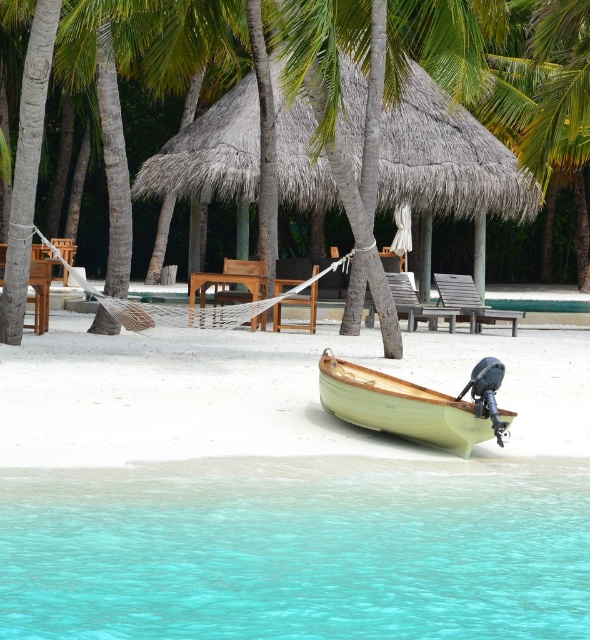
You are standing on the beach and want to walk to the turquoise clear water at lower center without stepping on the light wood boat at center. Which direction should you move from the boat to reach the water?

You should move to the right of the light wood boat at center to reach the turquoise clear water at lower center since the water is located to the right of the boat.

You are planning to move the wooden textured beach chair at center to the lower right corner of the image. Based on the scene description, will the light wood motorboat at lower center block your path?

The light wood motorboat at lower center is positioned at the lower center of the image and has a larger size compared to the wooden textured beach chair at center. Since the boat is larger and located centrally in the lower area, it would likely block the path to the lower right corner when moving the chair.